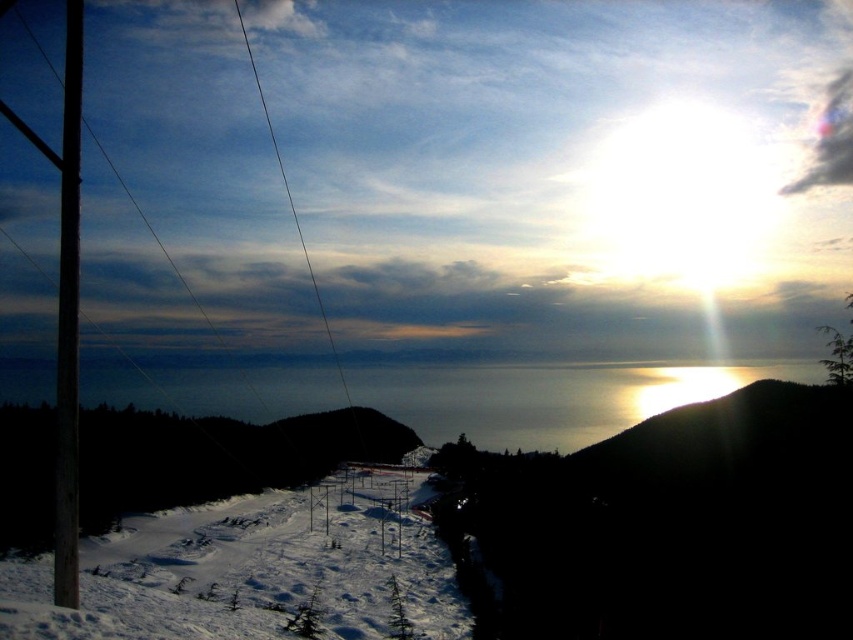
Question: Which point is closer to the camera?

Choices:
 (A) (631, 524)
 (B) (57, 436)
 (C) (448, 556)

Answer: (B)

Question: Considering the real-world distances, which object is closest to the silvery metallic hillside at upper right?

Choices:
 (A) smooth wire at center
 (B) white snow ski slope at center
 (C) smooth wooden pole at left

Answer: (B)

Question: Among these objects, which one is farthest from the camera?

Choices:
 (A) smooth wire at center
 (B) smooth wooden pole at left

Answer: (A)

Question: Where is silvery metallic hillside at upper right located in relation to white snow ski slope at center in the image?

Choices:
 (A) right
 (B) left

Answer: (A)

Question: Can you confirm if silvery metallic hillside at upper right is positioned above smooth wooden pole at left?

Choices:
 (A) no
 (B) yes

Answer: (A)

Question: Can you confirm if white snow ski slope at center is wider than smooth wooden pole at left?

Choices:
 (A) no
 (B) yes

Answer: (A)